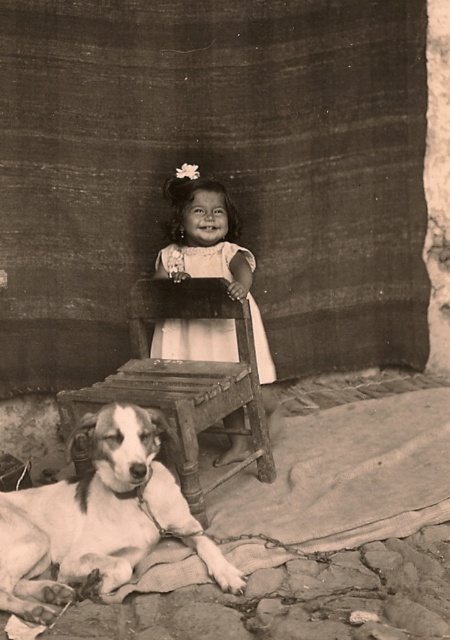
You are a photographer setting up a shoot in the scene. You need to place a small prop between the white matte dress at center and the wooden stool at lower left. Based on their positions, where should you place the prop so it doesn

The wooden stool at lower left is behind the white matte dress at center, so placing the prop in front of the white matte dress at center would ensure it is between the two objects.

In the scene, you notice a white fur dog at lower left and a white matte dress at center. Which object is shorter in height?

The white fur dog at lower left is shorter in height compared to the white matte dress at center.

You are a photographer setting up a tripod to capture the scene. The tripod requires a minimum space of 1 meter between the white fur dog at lower left and the white cotton dress at center. Based on the scene, can you determine if there is enough space between them?

The white fur dog at lower left is larger in size than the white cotton dress at center, but the exact distance between them is not provided. Therefore, it is impossible to determine if there is enough space for the tripod setup.